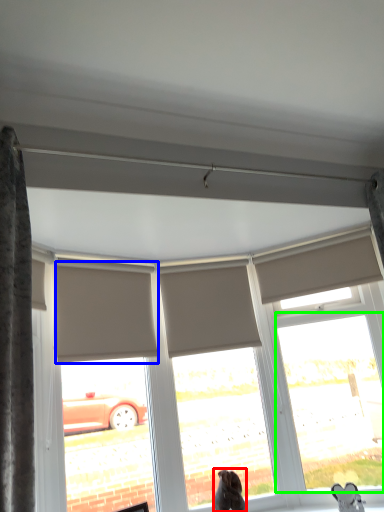
Question: Estimate the real-world distances between objects in this image. Which object is farther from dog (highlighted by a red box), shutter (highlighted by a blue box) or window (highlighted by a green box)?

Choices:
 (A) shutter
 (B) window

Answer: (A)